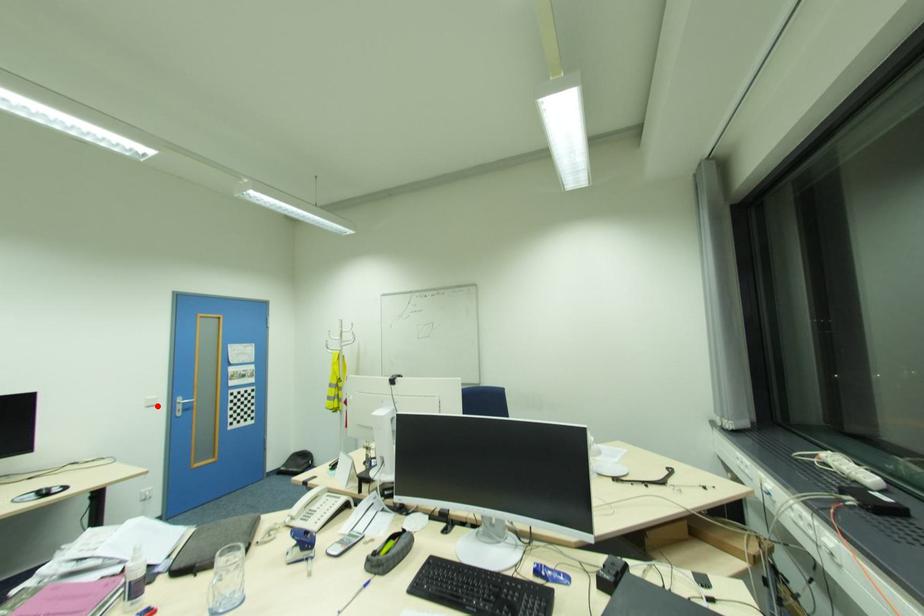
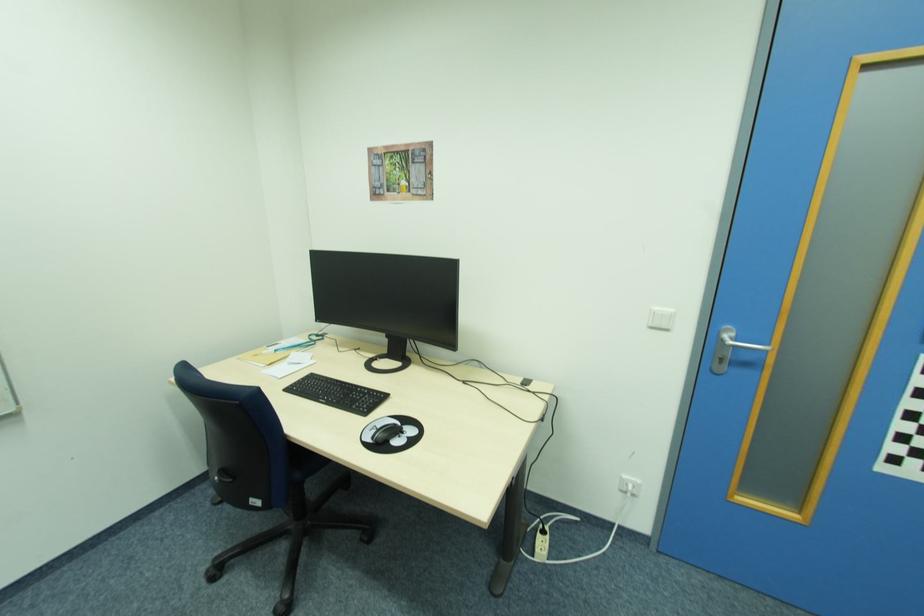
The point at the highlighted location is marked in the first image. Where is the corresponding point in the second image?

(670, 329)